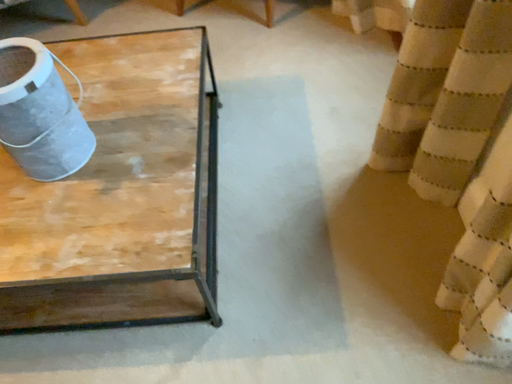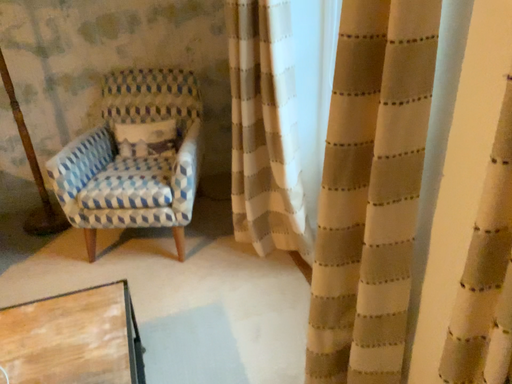
Question: Which way did the camera rotate in the video?

Choices:
 (A) rotated right
 (B) rotated left

Answer: (A)